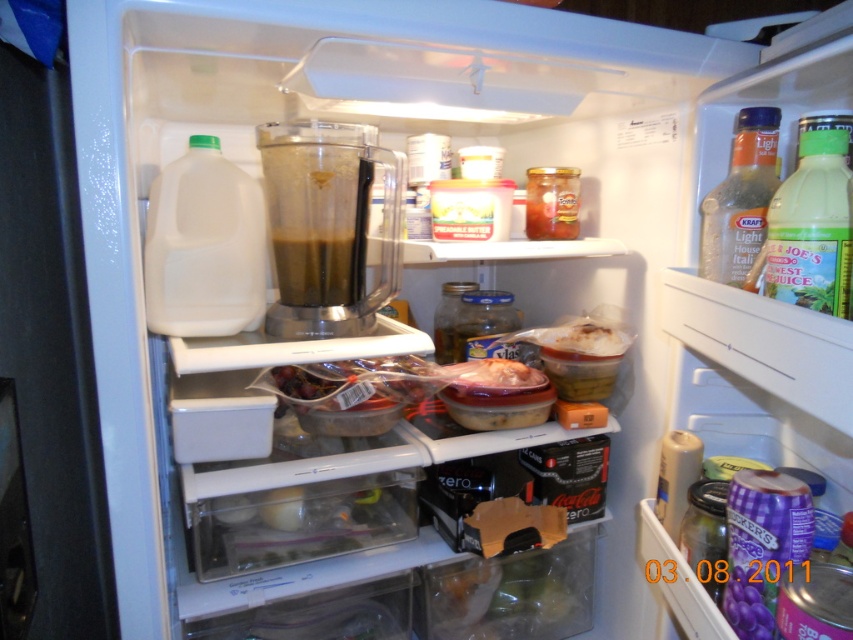
You are organizing the items in the refrigerator and need to place a new item that requires more space. Which object, the transparent plastic blender at center or the translucent plastic bottle at upper right, should you move to accommodate the larger item?

You should move the translucent plastic bottle at upper right because the transparent plastic blender at center is already larger and would not be as easy to move for accommodating the new item.